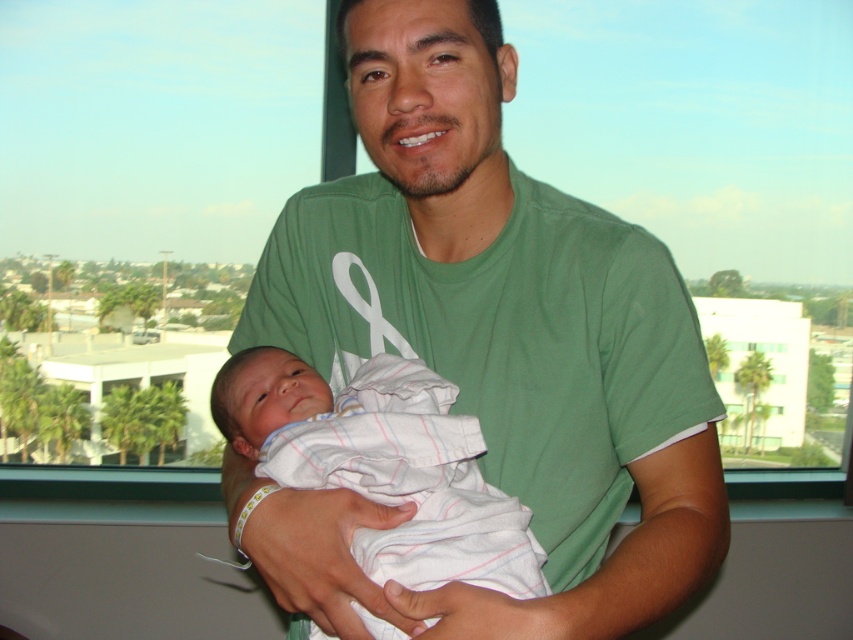
Question: Among these points, which one is farthest from the camera?

Choices:
 (A) (427, 420)
 (B) (396, 250)

Answer: (B)

Question: Can you confirm if green cotton shirt at center is positioned to the right of white striped cloth at center?

Choices:
 (A) yes
 (B) no

Answer: (A)

Question: Which object is farther from the camera taking this photo?

Choices:
 (A) white striped cloth at center
 (B) green cotton shirt at center

Answer: (A)

Question: Observing the image, what is the correct spatial positioning of green cotton shirt at center in reference to white striped cloth at center?

Choices:
 (A) below
 (B) above

Answer: (B)

Question: Can you confirm if green cotton shirt at center is bigger than white striped cloth at center?

Choices:
 (A) yes
 (B) no

Answer: (A)

Question: Which point is closer to the camera taking this photo?

Choices:
 (A) (619, 248)
 (B) (247, 435)

Answer: (A)